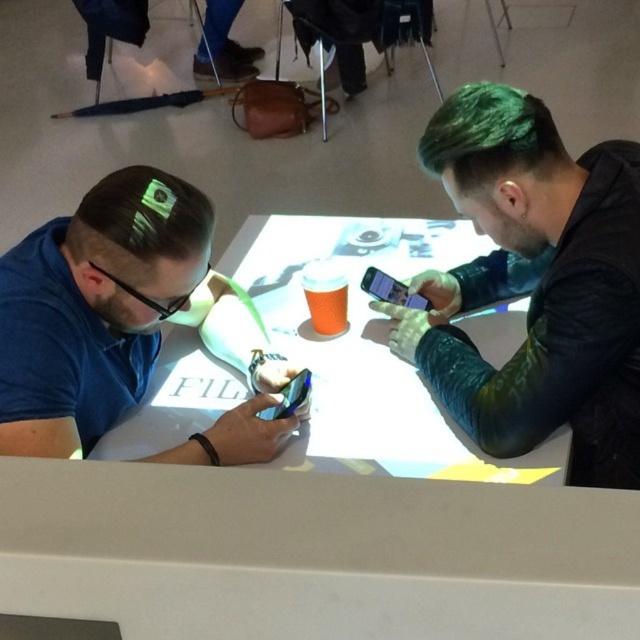
You are a photographer trying to capture a closeup of the brown matte hair at center and the green dyed hair at upper right. Which hair color will appear larger in the photo?

The brown matte hair at center will appear larger in the photo because it is closer to the viewer than the green dyed hair at upper right.

You are designing a new augmented reality filter that needs to overlay elements on the brown matte hair at center and the black matte glasses at left. The filter requires the elements to scale proportionally to the size of each object. Which object should have a larger overlay element to maintain the correct scale?

The brown matte hair at center should have a larger overlay element because it is bigger than the black matte glasses at left according to the description.

You are a photographer trying to capture a closeup shot of the black matte glasses at left without including the brown matte hair at center in the frame. Is this possible given their positions?

The brown matte hair at center is above the black matte glasses at left, so if you position the camera below the glasses and angle it upwards, you can capture the black matte glasses at left without including the brown matte hair at center in the frame.